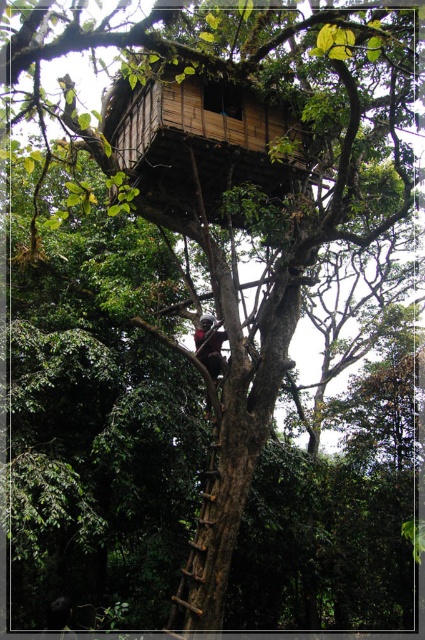
Question: Which of the following is the farthest from the observer?

Choices:
 (A) (197, 333)
 (B) (175, 612)
 (C) (56, 618)

Answer: (A)

Question: Is wooden textured ladder at center smaller than dark brown skin at center?

Choices:
 (A) yes
 (B) no

Answer: (A)

Question: Among these points, which one is farthest from the camera?

Choices:
 (A) (198, 339)
 (B) (218, 458)
 (C) (57, 602)

Answer: (C)

Question: Can you confirm if wooden textured ladder at center is positioned to the left of dark brown leather helmet at upper center?

Choices:
 (A) no
 (B) yes

Answer: (A)

Question: Observing the image, what is the correct spatial positioning of wooden textured ladder at center in reference to dark brown leather helmet at upper center?

Choices:
 (A) right
 (B) left

Answer: (A)

Question: Which point is farther to the camera?

Choices:
 (A) (197, 532)
 (B) (65, 621)
 (C) (218, 339)

Answer: (C)